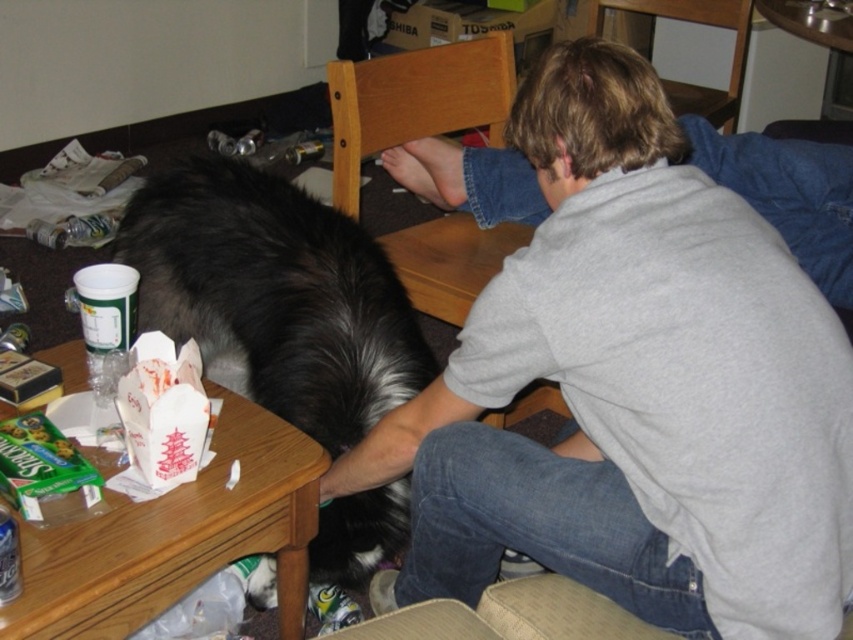
Which is in front, point (170, 324) or point (254, 520)?

Point (254, 520) is in front.

Does black fur dog at center have a greater width compared to wooden table at lower left?

Yes.

Is point (366, 292) behind point (178, 566)?

Yes, it is behind point (178, 566).

Where is `black fur dog at center`? The height and width of the screenshot is (640, 853). black fur dog at center is located at coordinates (274, 296).